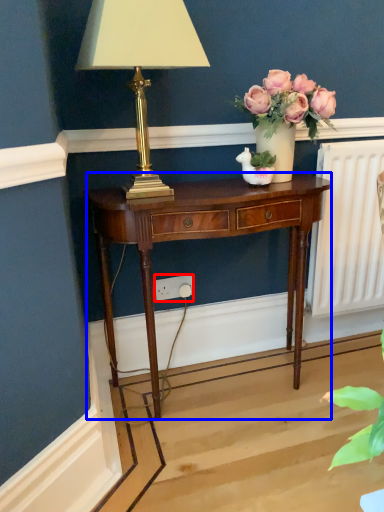
Question: Which point is further to the camera, power outlet (highlighted by a red box) or nightstand (highlighted by a blue box)?

Choices:
 (A) power outlet
 (B) nightstand

Answer: (A)